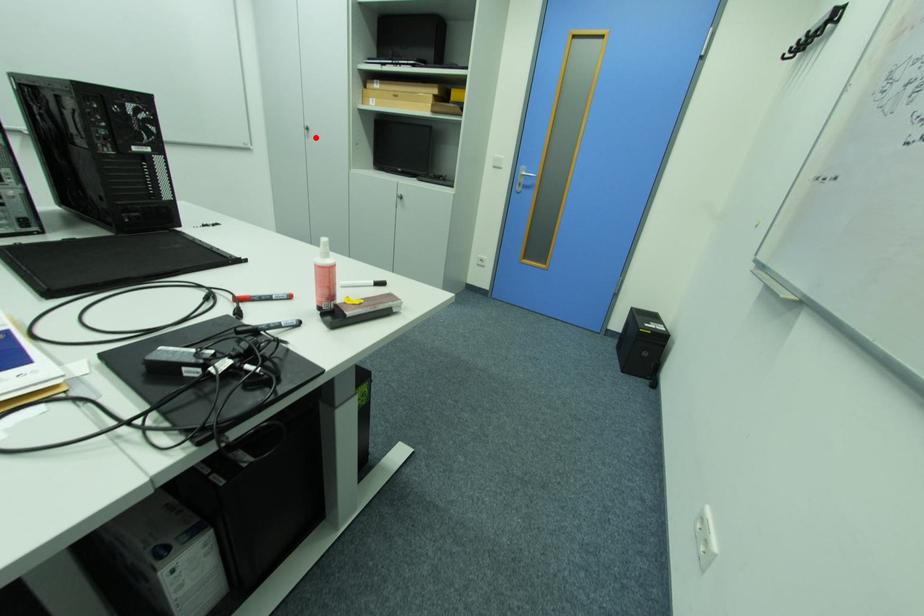
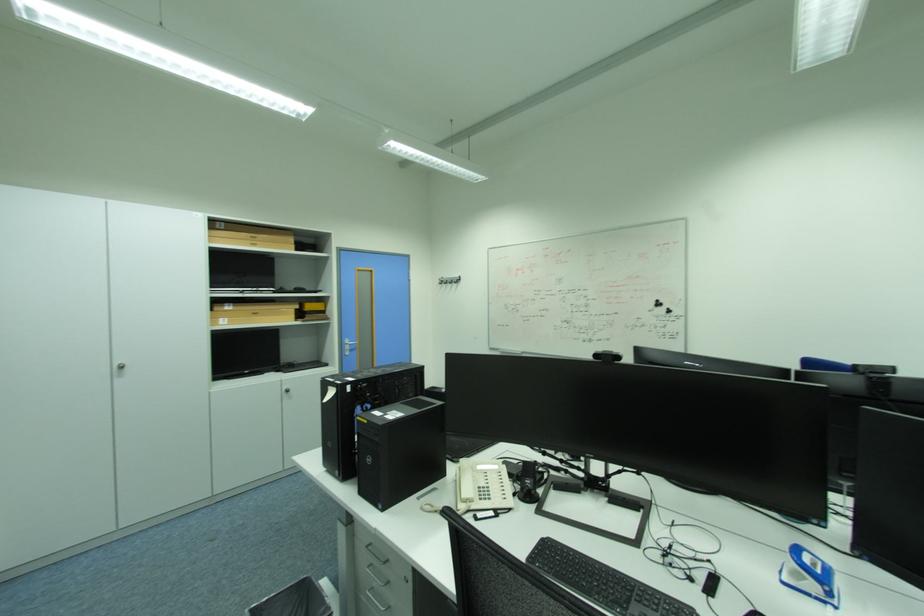
Where in the second image is the point corresponding to the highlighted location from the first image?

(128, 376)